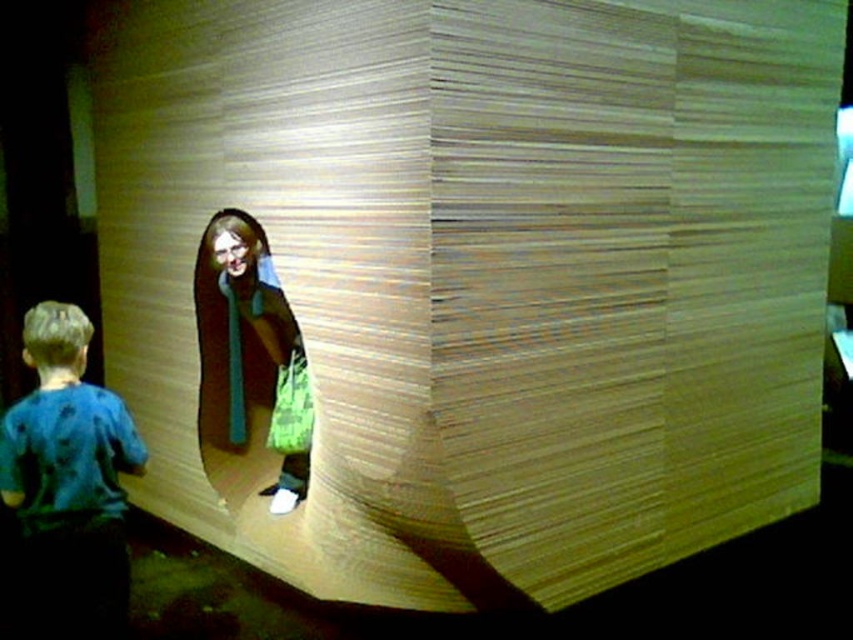
You are standing in the scene and want to hand a toy to both the child wearing the blue fabric shirt at lower left and the person in the matte brown coat at center. Which child should you approach first to ensure you can reach them without moving closer?

You should approach the blue fabric shirt at lower left first because it is closer to the viewer than the matte brown coat at center, so you can reach them without needing to move closer.

You are a delivery person who needs to place a heavy box on the green fabric shopping bag at center. However, there is a blue fabric shirt at lower left in the way. Can you place the box on the shopping bag without moving the shirt?

The blue fabric shirt at lower left is below the green fabric shopping bag at center, so you can place the box on the shopping bag without moving the shirt because the shirt is already positioned underneath.